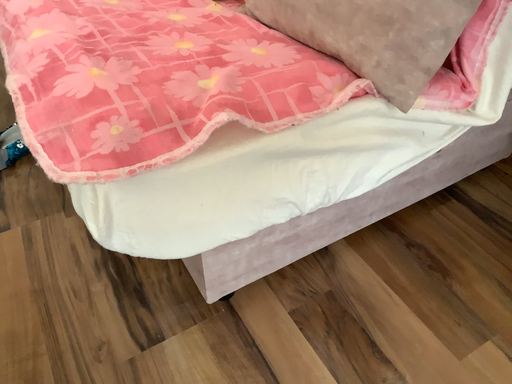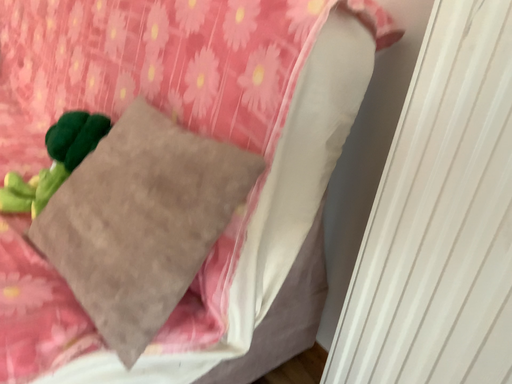
Question: Which way did the camera rotate in the video?

Choices:
 (A) rotated upward
 (B) rotated downward

Answer: (A)